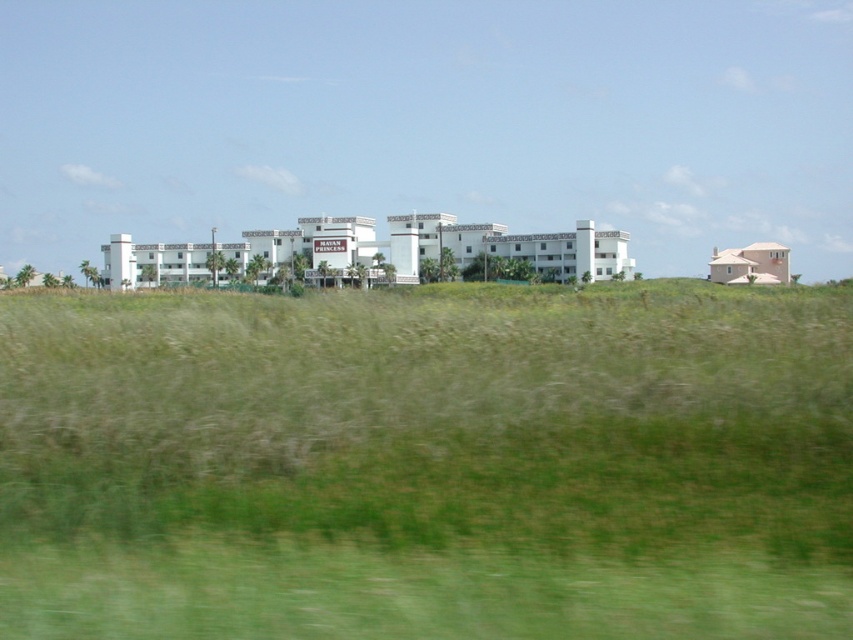
You are a photographer trying to capture the entire white matte building at center in your shot. You notice the green grassy field at center is also in the frame. Based on their widths, will the building take up more space in the photo than the grass?

The green grassy field at center has a width less than the white matte building at center, so the building will take up more space in the photo than the grass.

You are standing in the open landscape and want to take a photo of both the white matte building at center and the pink stucco house at right. Which one should you focus on first if you want to capture both in your camera frame?

The white matte building at center is located below the pink stucco house at right, so you should focus on the pink stucco house at right first to ensure both are in the frame.